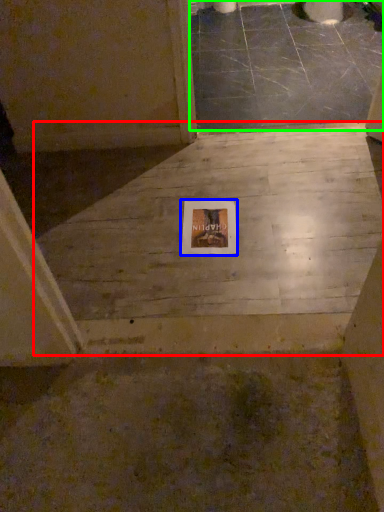
Question: Which is nearer to the concrete (highlighted by a red box)? picture frame (highlighted by a blue box) or concrete (highlighted by a green box).

Choices:
 (A) picture frame
 (B) concrete

Answer: (A)